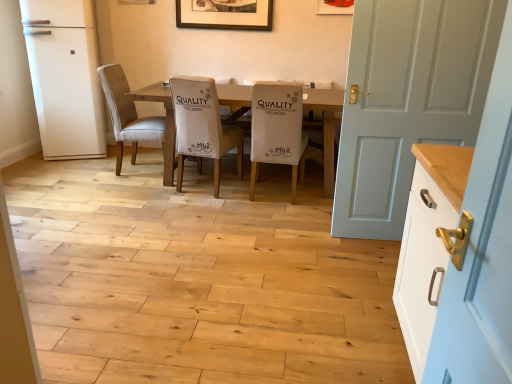
Identify the location of vacant space behind white painted wood cabinet at right. (352, 298).